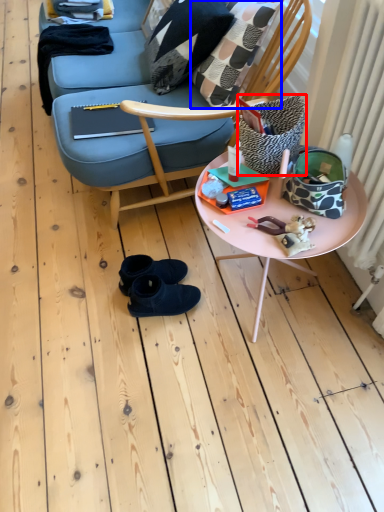
Question: Which object is closer to the camera taking this photo, pillow (highlighted by a red box) or throw pillow (highlighted by a blue box)?

Choices:
 (A) pillow
 (B) throw pillow

Answer: (A)